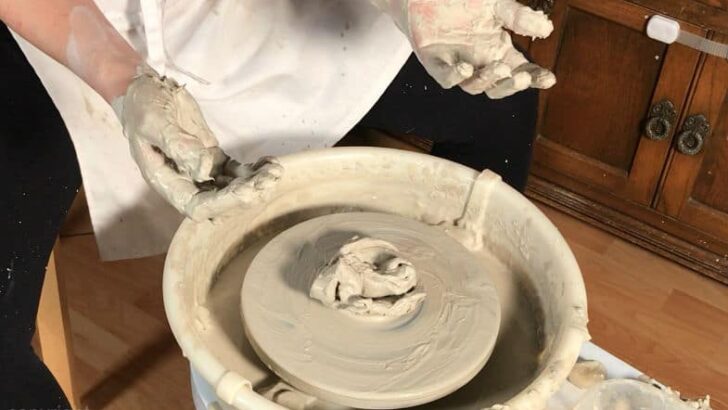
The height and width of the screenshot is (410, 728). Identify the location of drawers. (622, 105), (710, 197).